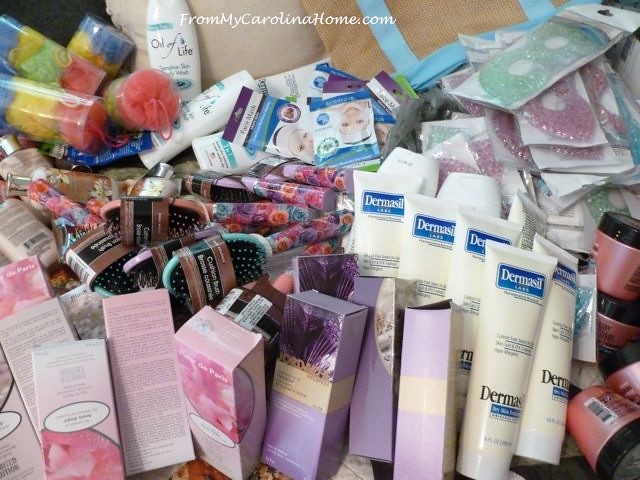
In order to click on box in this screenshot , I will do `click(86, 404)`, `click(45, 336)`, `click(31, 288)`, `click(22, 425)`, `click(148, 344)`, `click(220, 351)`, `click(316, 345)`, `click(331, 274)`, `click(374, 308)`, `click(426, 336)`.